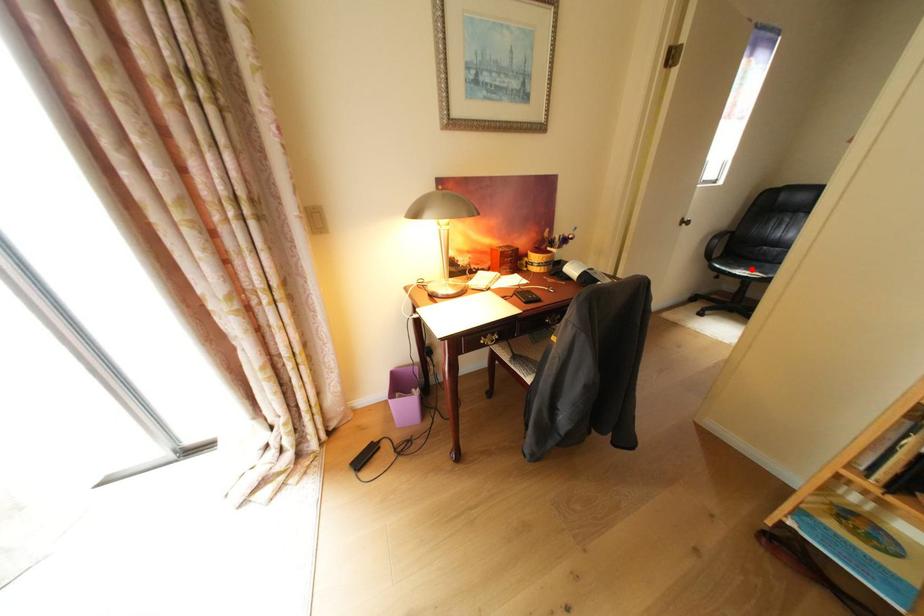
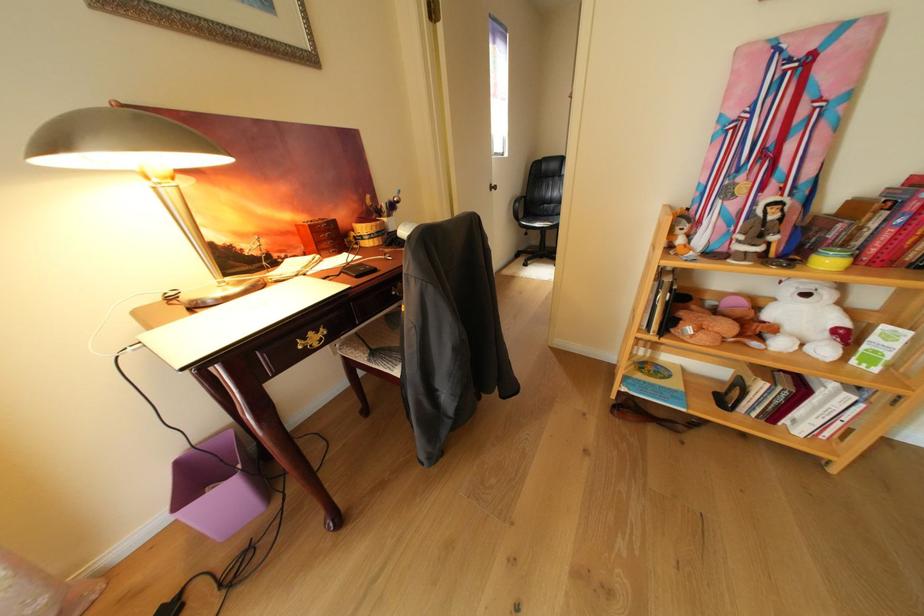
The point at the highlighted location is marked in the first image. Where is the corresponding point in the second image?

(550, 224)